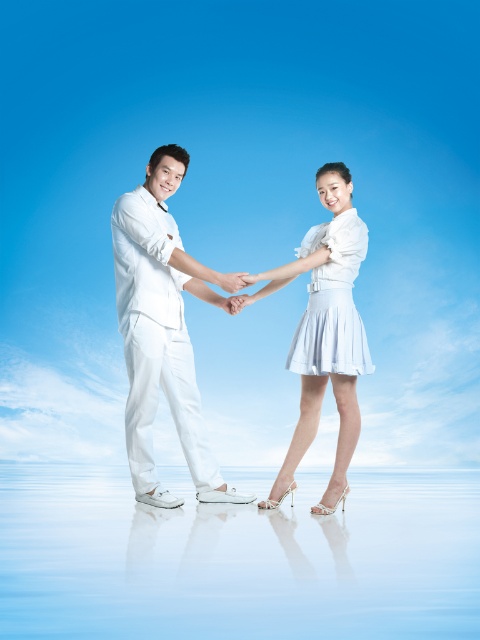
Looking at this image, which is more to the right, white satin skirt at center or white satin dress at center?

Positioned to the right is white satin dress at center.

Between white satin skirt at center and white satin dress at center, which one has less height?

white satin dress at center

Where is `white satin skirt at center`? This screenshot has width=480, height=640. white satin skirt at center is located at coordinates (324, 332).

I want to click on white satin skirt at center, so click(324, 332).

Measure the distance between white glossy water at center and white satin dress at center.

white glossy water at center and white satin dress at center are 1.41 meters apart.

Where is `white glossy water at center`? This screenshot has height=640, width=480. white glossy water at center is located at coordinates (238, 557).

Is point (62, 509) farther from viewer compared to point (361, 358)?

No, (62, 509) is in front of (361, 358).

Where is `white glossy water at center`? The width and height of the screenshot is (480, 640). white glossy water at center is located at coordinates (238, 557).

Which is more to the left, white glossy water at center or white satin skirt at center?

white glossy water at center is more to the left.

Is white glossy water at center shorter than white satin skirt at center?

Yes, white glossy water at center is shorter than white satin skirt at center.

Which is in front, point (369, 506) or point (346, 369)?

Point (346, 369) is in front.

The height and width of the screenshot is (640, 480). Find the location of `white glossy water at center`. white glossy water at center is located at coordinates (238, 557).